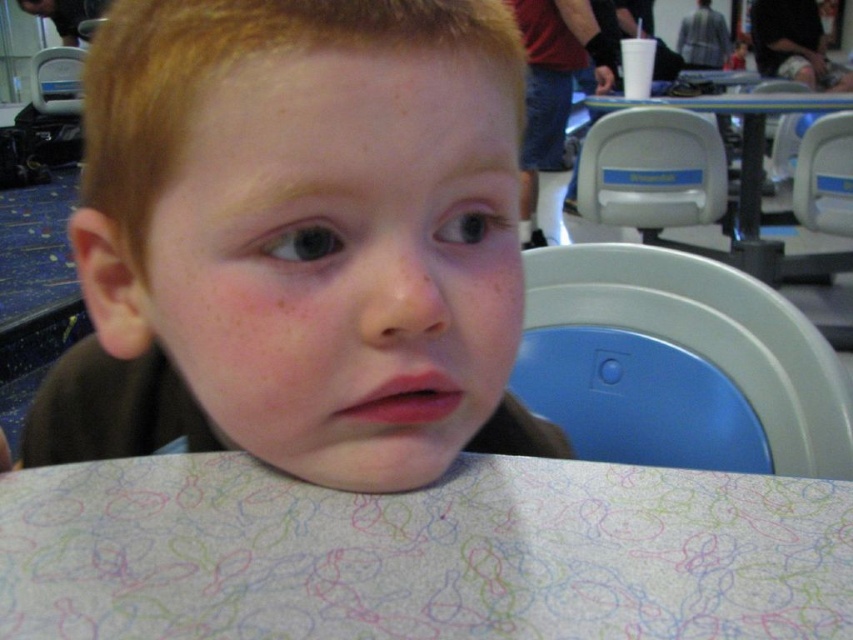
You are a photographer trying to capture a clear shot of the smooth skin child at center and the white paper at center. Since the child is slightly out of focus, where should you adjust your camera focus to ensure both are in focus?

The smooth skin child at center is positioned on the left side of white paper at center. To ensure both are in focus, adjust the camera focus to the midpoint between them.

You are a photographer who wants to capture a clear shot of the white paper at center and the white plastic table at center. Since the child is sitting at the table, where should you position yourself relative to the child to ensure both objects are in focus?

The white paper at center is to the left of the white plastic table at center, so you should position yourself to the left side of the child to ensure both objects are in focus.